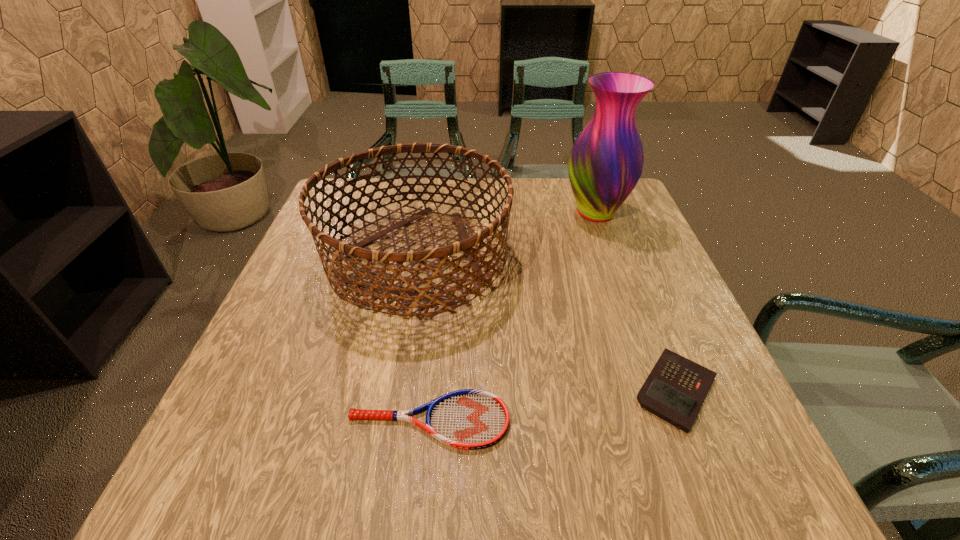
At what (x,y) coordinates should I click in order to perform the action: click on blank region between the calculator and the tennis racket. Please return your answer as a coordinate pair (x, y). This screenshot has width=960, height=540. Looking at the image, I should click on (553, 406).

Image resolution: width=960 pixels, height=540 pixels. What are the coordinates of `object that stands as the third closest to the vase` in the screenshot? It's located at (470, 419).

Locate an element on the screen. This screenshot has width=960, height=540. the second closest object to the tennis racket is located at coordinates (675, 390).

This screenshot has width=960, height=540. I want to click on free location that satisfies the following two spatial constraints: 1. on the back side of the third shortest object; 2. on the left side of the tallest object, so (424, 213).

Identify the location of vacant position in the image that satisfies the following two spatial constraints: 1. on the back side of the tallest object; 2. on the left side of the third shortest object. (424, 213).

The width and height of the screenshot is (960, 540). What are the coordinates of `vacant area that satisfies the following two spatial constraints: 1. on the front side of the basket; 2. on the right side of the calculator` in the screenshot? It's located at (393, 390).

The width and height of the screenshot is (960, 540). In order to click on vacant region that satisfies the following two spatial constraints: 1. on the front side of the tennis racket; 2. on the right side of the second tallest object in this screenshot , I will do `click(388, 421)`.

Where is `vacant position in the image that satisfies the following two spatial constraints: 1. on the front side of the tallest object; 2. on the left side of the calculator`? The height and width of the screenshot is (540, 960). vacant position in the image that satisfies the following two spatial constraints: 1. on the front side of the tallest object; 2. on the left side of the calculator is located at coordinates coord(660,390).